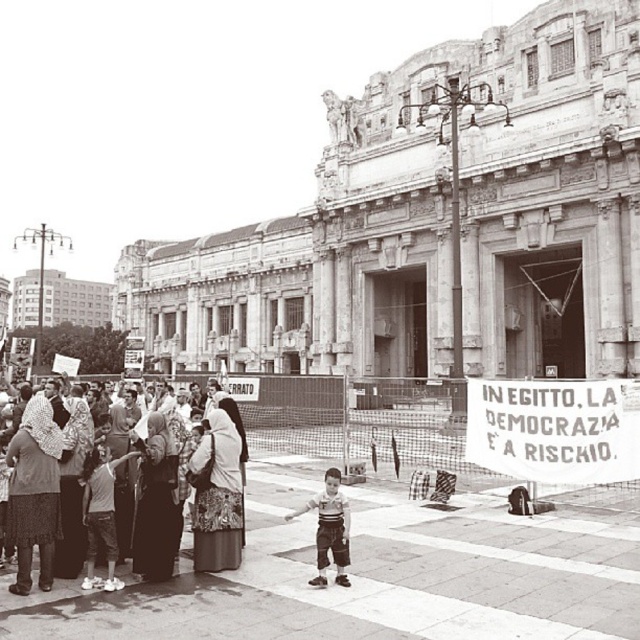
In the scene shown: You are a photographer analyzing the image. You notice the matte fabric crowd at center left and the light brown pants at center. Based on their spatial relationship, which object appears smaller in the photo?

The matte fabric crowd at center left occupies less space than the light brown pants at center, so it appears smaller in the photo.

You are standing in front of a historic building and see the matte fabric crowd at center left and the light brown pants at center. Which object is closer to you?

The matte fabric crowd at center left is closer to you because it is further to the viewer than the light brown pants at center.

You are standing at the entrance of the grand historic building and notice the matte fabric crowd at center left. Based on their position, can you estimate how far they are from the building entrance?

The matte fabric crowd at center left is located at point (35,492), which means they are relatively close to the entrance of the grand historic building.